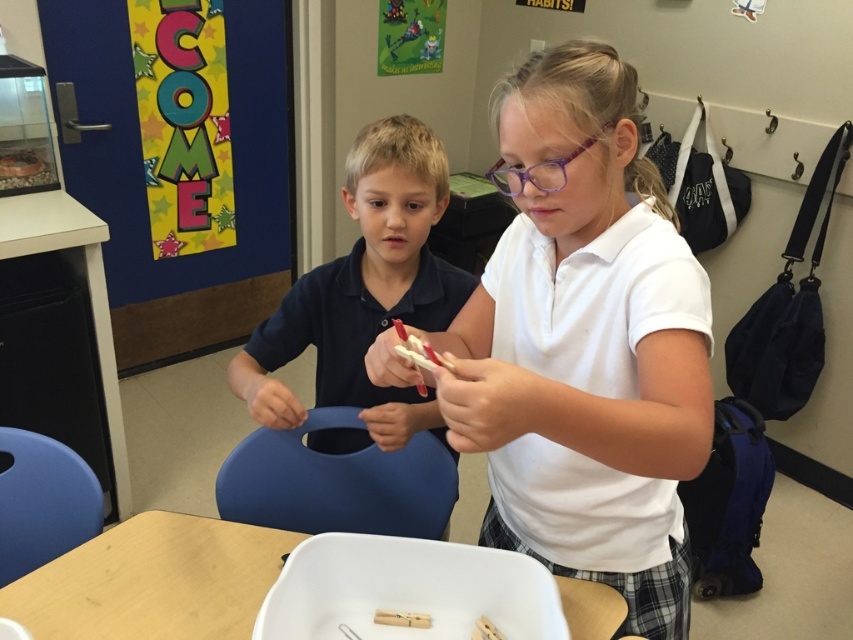
You are a photographer standing in front of the classroom scene. You want to take a photo focusing on the white matte shirt at center and the wooden clothespin at center. Which object will appear larger in the photo?

The white matte shirt at center will appear larger in the photo because it is closer to the viewer than the wooden clothespin at center.

You are a photographer standing in the classroom and want to take a photo of the matte blue shirt at center and the wooden clothespin at center. Which object will appear larger in the photo?

The matte blue shirt at center will appear larger in the photo because it is closer to the photographer than the wooden clothespin at center.

You are a teacher observing the classroom scene. You notice the matte blue shirt at center and the wooden clothespin at center. Based on their sizes, which object would require more space to store in a storage box?

The matte blue shirt at center has a larger size compared to the wooden clothespin at center, so it would require more space to store in a storage box.